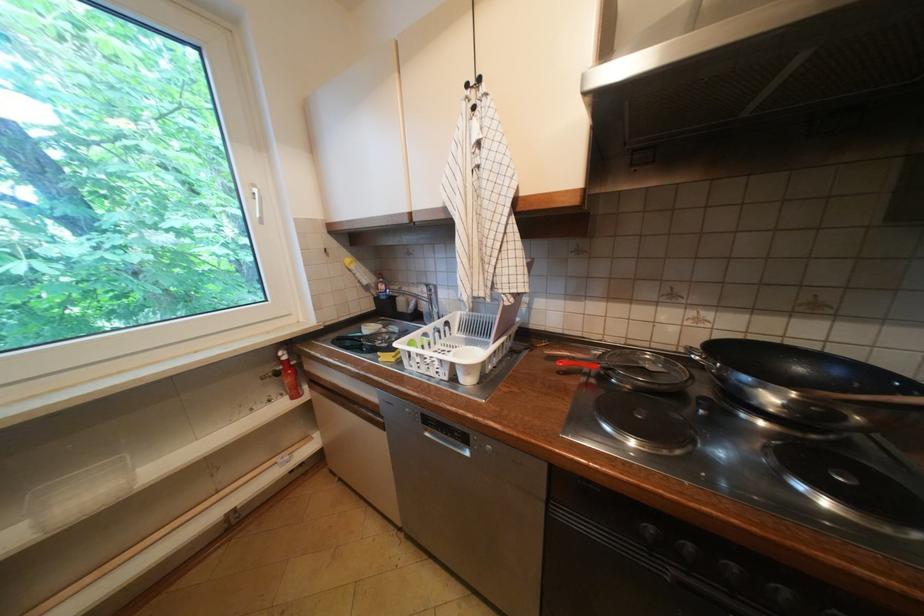
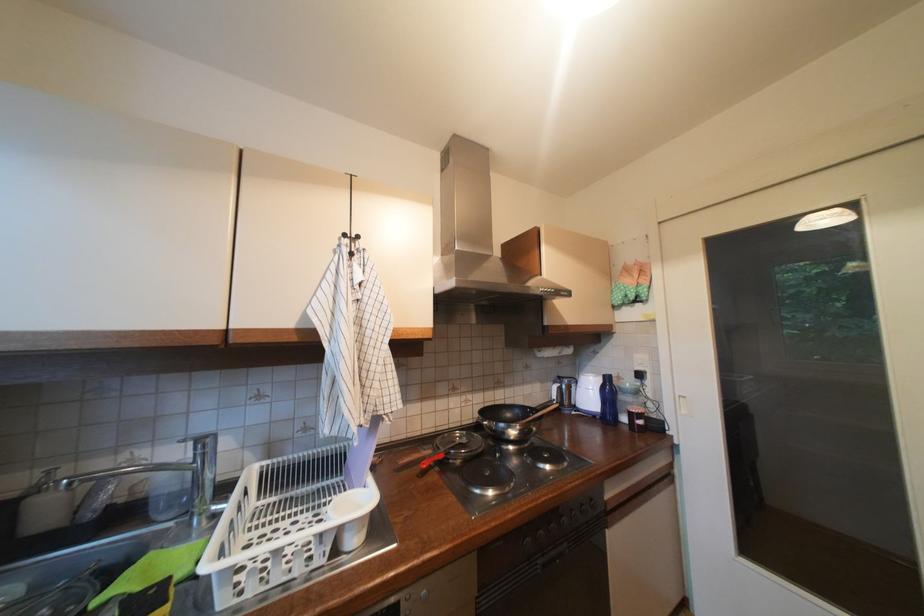
Question: Based on the continuous images, in which direction is the camera rotating? Reply with the corresponding letter.

Choices:
 (A) Left
 (B) Right
 (C) Up
 (D) Down

Answer: (B)